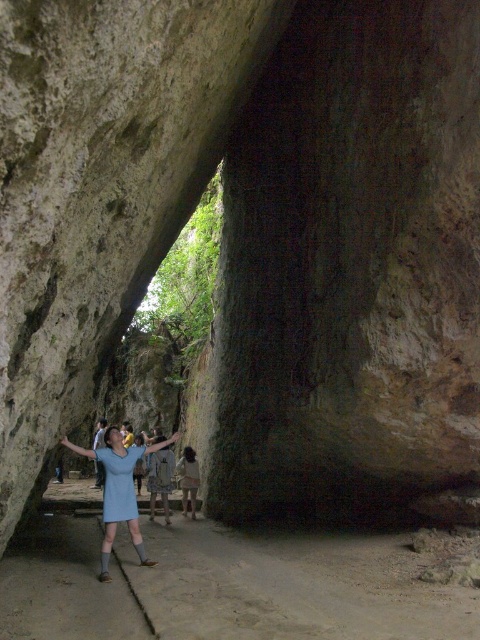
Does light blue fabric dress at center have a smaller size compared to blue dress at center?

Yes, light blue fabric dress at center is smaller than blue dress at center.

Is light blue fabric dress at center to the left of blue dress at center from the viewer's perspective?

No, light blue fabric dress at center is not to the left of blue dress at center.

The image size is (480, 640). What are the coordinates of `light blue fabric dress at center` in the screenshot? It's located at (119, 490).

Identify the location of light blue fabric dress at center. The height and width of the screenshot is (640, 480). (119, 490).

Does light blue fabric dress at center have a larger size compared to light brown fabric dress at center?

Yes, light blue fabric dress at center is bigger than light brown fabric dress at center.

Who is taller, light blue fabric dress at center or light brown fabric dress at center?

light blue fabric dress at center is taller.

This screenshot has height=640, width=480. Describe the element at coordinates (119, 490) in the screenshot. I see `light blue fabric dress at center` at that location.

Locate an element on the screen. The height and width of the screenshot is (640, 480). light blue fabric dress at center is located at coordinates (119, 490).

Does light brown fabric dress at center come behind blue dress at center?

Yes, light brown fabric dress at center is behind blue dress at center.

In the scene shown: Which is more to the left, light brown fabric dress at center or blue dress at center?

Positioned to the left is blue dress at center.

Which is behind, point (191, 460) or point (95, 460)?

Positioned behind is point (95, 460).

The image size is (480, 640). I want to click on light brown fabric dress at center, so click(189, 480).